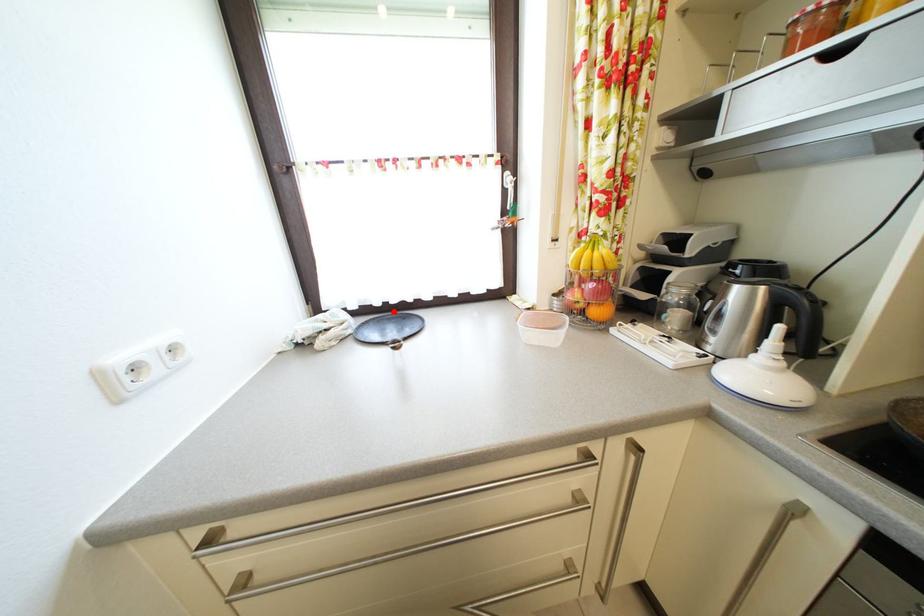
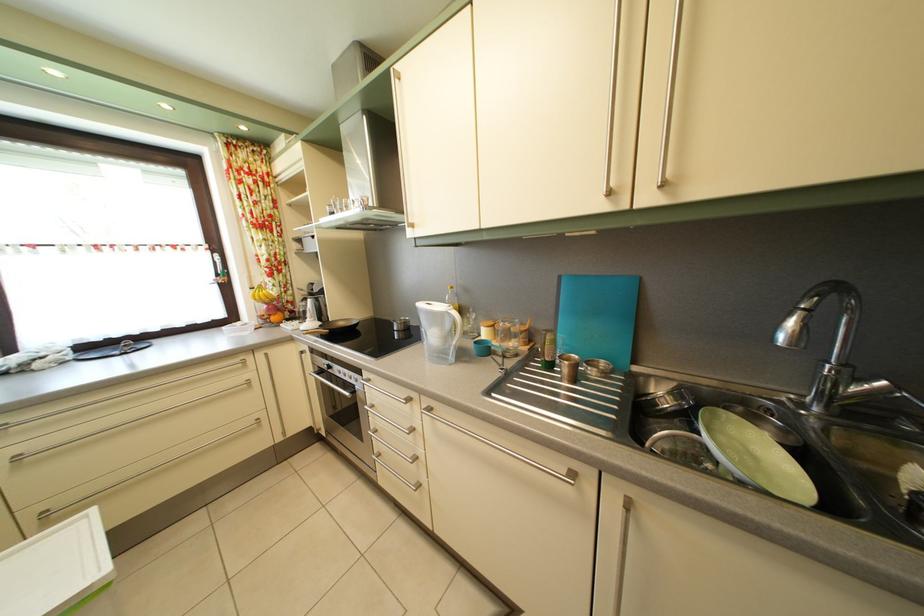
Where in the second image is the point corresponding to the highlighted location from the first image?

(116, 347)